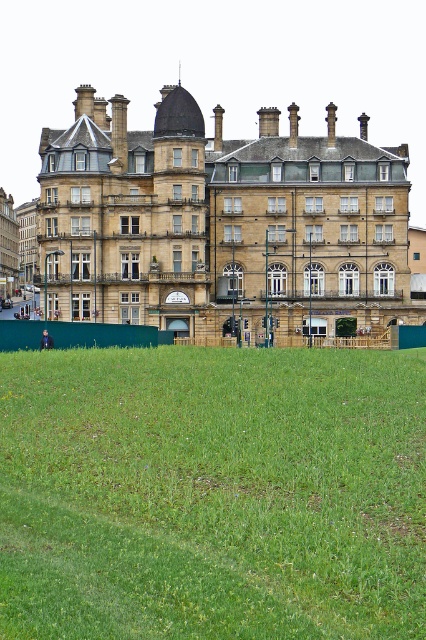
Does green grass at lower center have a larger size compared to brown stone building at center?

Actually, green grass at lower center might be smaller than brown stone building at center.

Does point (51, 529) come farther from viewer compared to point (60, 317)?

No, (51, 529) is in front of (60, 317).

At what (x,y) coordinates should I click in order to perform the action: click on green grass at lower center. Please return your answer as a coordinate pair (x, y). This screenshot has width=426, height=640. Looking at the image, I should click on (212, 493).